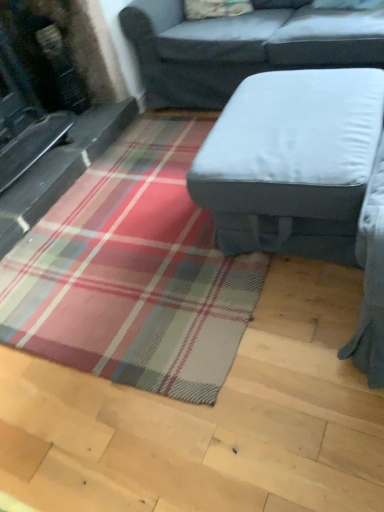
Question: Is gray fabric studio couch at center, the second studio couch from the bottom, spatially inside light gray fabric ottoman at center, arranged as the first studio couch when ordered from the bottom, or outside of it?

Choices:
 (A) outside
 (B) inside

Answer: (A)

Question: In terms of size, does gray fabric studio couch at center, the 1th studio couch when ordered from top to bottom, appear bigger or smaller than light gray fabric ottoman at center, arranged as the first studio couch when ordered from the bottom?

Choices:
 (A) big
 (B) small

Answer: (A)

Question: In the image, is gray fabric studio couch at center, the 1th studio couch when ordered from top to bottom, on the left side or the right side of light gray fabric ottoman at center, arranged as the first studio couch when ordered from the bottom?

Choices:
 (A) left
 (B) right

Answer: (B)

Question: Is light gray fabric ottoman at center, arranged as the first studio couch when ordered from the bottom, bigger or smaller than gray fabric studio couch at center, the second studio couch from the bottom?

Choices:
 (A) big
 (B) small

Answer: (B)

Question: Relative to gray fabric studio couch at center, the 1th studio couch when ordered from top to bottom, is light gray fabric ottoman at center, arranged as the first studio couch when ordered from the bottom, in front or behind?

Choices:
 (A) behind
 (B) front

Answer: (B)

Question: From the image's perspective, is light gray fabric ottoman at center, which is the second studio couch from top to bottom, positioned above or below gray fabric studio couch at center, the second studio couch from the bottom?

Choices:
 (A) below
 (B) above

Answer: (A)

Question: Is light gray fabric ottoman at center, arranged as the first studio couch when ordered from the bottom, situated inside gray fabric studio couch at center, the 1th studio couch when ordered from top to bottom, or outside?

Choices:
 (A) inside
 (B) outside

Answer: (B)